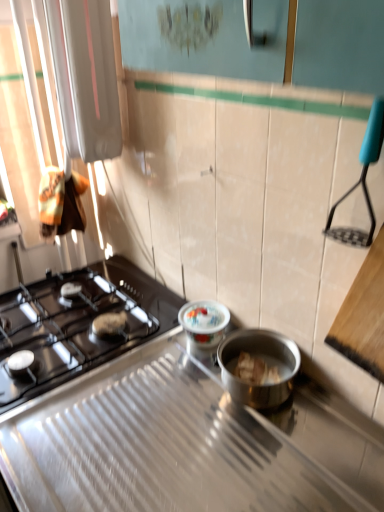
Question: Considering the relative sizes of black glass gas stove at left, placed as the 1th gas stove when sorted from back to front, and porcelain floral-patterned container at center in the image provided, is black glass gas stove at left, placed as the 1th gas stove when sorted from back to front, bigger than porcelain floral-patterned container at center?

Choices:
 (A) yes
 (B) no

Answer: (A)

Question: Is black glass gas stove at left, the second gas stove from the front, positioned before porcelain floral-patterned container at center?

Choices:
 (A) no
 (B) yes

Answer: (B)

Question: Can you confirm if black glass gas stove at left, the second gas stove from the front, is taller than porcelain floral-patterned container at center?

Choices:
 (A) no
 (B) yes

Answer: (B)

Question: From a real-world perspective, does black glass gas stove at left, the second gas stove from the front, stand above porcelain floral-patterned container at center?

Choices:
 (A) no
 (B) yes

Answer: (A)

Question: Would you say porcelain floral-patterned container at center is part of black glass gas stove at left, the second gas stove from the front,'s contents?

Choices:
 (A) yes
 (B) no

Answer: (B)

Question: Considering the relative sizes of black glass gas stove at left, placed as the 1th gas stove when sorted from back to front, and porcelain floral-patterned container at center in the image provided, is black glass gas stove at left, placed as the 1th gas stove when sorted from back to front, smaller than porcelain floral-patterned container at center?

Choices:
 (A) no
 (B) yes

Answer: (A)

Question: Is black matte gas stove at left, which is counted as the 1th gas stove, starting from the front, thinner than black glass gas stove at left, the second gas stove from the front?

Choices:
 (A) yes
 (B) no

Answer: (B)

Question: Is black matte gas stove at left, which is the second gas stove from back to front, further to the viewer compared to black glass gas stove at left, the second gas stove from the front?

Choices:
 (A) yes
 (B) no

Answer: (B)

Question: Is black glass gas stove at left, the second gas stove from the front, inside black matte gas stove at left, which is counted as the 1th gas stove, starting from the front?

Choices:
 (A) no
 (B) yes

Answer: (A)

Question: Is black matte gas stove at left, which is counted as the 1th gas stove, starting from the front, facing away from black glass gas stove at left, the second gas stove from the front?

Choices:
 (A) yes
 (B) no

Answer: (B)

Question: Are black matte gas stove at left, which is the second gas stove from back to front, and black glass gas stove at left, the second gas stove from the front, making contact?

Choices:
 (A) yes
 (B) no

Answer: (B)

Question: From the image's perspective, is black matte gas stove at left, which is the second gas stove from back to front, above black glass gas stove at left, placed as the 1th gas stove when sorted from back to front?

Choices:
 (A) no
 (B) yes

Answer: (A)

Question: Can you confirm if porcelain floral-patterned container at center is bigger than black glass gas stove at left, placed as the 1th gas stove when sorted from back to front?

Choices:
 (A) yes
 (B) no

Answer: (B)